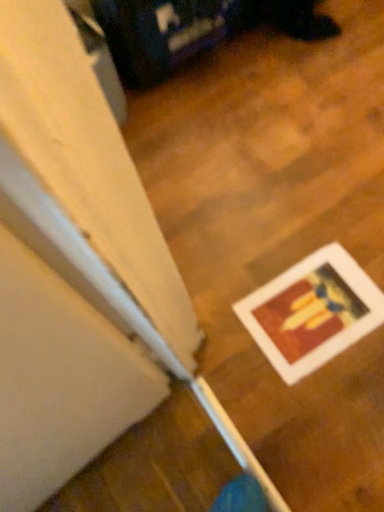
The width and height of the screenshot is (384, 512). What do you see at coordinates (312, 312) in the screenshot?
I see `white matte picture frame at lower right` at bounding box center [312, 312].

What are the coordinates of `white matte picture frame at lower right` in the screenshot? It's located at (312, 312).

The image size is (384, 512). What do you see at coordinates (279, 233) in the screenshot?
I see `wooden floor at lower right` at bounding box center [279, 233].

Where is `wooden floor at lower right`? This screenshot has width=384, height=512. wooden floor at lower right is located at coordinates (x=279, y=233).

Locate an element on the screen. The height and width of the screenshot is (512, 384). white matte picture frame at lower right is located at coordinates tap(312, 312).

Which is more to the left, white matte picture frame at lower right or wooden floor at lower right?

Positioned to the left is wooden floor at lower right.

Considering their positions, is white matte picture frame at lower right located in front of or behind wooden floor at lower right?

Clearly, white matte picture frame at lower right is behind wooden floor at lower right.

Is point (260, 340) positioned behind point (357, 112)?

That is False.

From the image's perspective, is white matte picture frame at lower right located beneath wooden floor at lower right?

Yes, from the image's perspective, white matte picture frame at lower right is beneath wooden floor at lower right.

Looking at this image, from a real-world perspective, who is located higher, white matte picture frame at lower right or wooden floor at lower right?

From a 3D spatial view, white matte picture frame at lower right is above.

Considering the relative sizes of white matte picture frame at lower right and wooden floor at lower right in the image provided, is white matte picture frame at lower right wider than wooden floor at lower right?

In fact, white matte picture frame at lower right might be narrower than wooden floor at lower right.

In terms of height, does white matte picture frame at lower right look taller or shorter compared to wooden floor at lower right?

Considering their sizes, white matte picture frame at lower right has more height than wooden floor at lower right.

Between white matte picture frame at lower right and wooden floor at lower right, which one has larger size?

With larger size is wooden floor at lower right.

Would you say white matte picture frame at lower right is inside or outside wooden floor at lower right?

white matte picture frame at lower right is contained in wooden floor at lower right.

Is white matte picture frame at lower right directly adjacent to wooden floor at lower right?

No, white matte picture frame at lower right is not making contact with wooden floor at lower right.

Is white matte picture frame at lower right oriented away from wooden floor at lower right?

Yes, white matte picture frame at lower right is facing away from wooden floor at lower right.

How far apart are white matte picture frame at lower right and wooden floor at lower right?

7.46 inches.

You are a GUI agent. You are given a task and a screenshot of the screen. Output one action in this format:
    pyautogui.click(x=<x>, y=<y>)
    Task: Click on the picture frame above the wooden floor at lower right (from a real-world perspective)
    
    Given the screenshot: What is the action you would take?
    pyautogui.click(x=312, y=312)

Can you confirm if wooden floor at lower right is positioned to the left of white matte picture frame at lower right?

Yes, wooden floor at lower right is to the left of white matte picture frame at lower right.

Which object is closer to the camera taking this photo, wooden floor at lower right or white matte picture frame at lower right?

wooden floor at lower right is closer to the camera.

Which point is more distant from viewer, (x=345, y=383) or (x=338, y=350)?

The point (x=338, y=350) is farther.

From the image's perspective, is wooden floor at lower right located beneath white matte picture frame at lower right?

No, from the image's perspective, wooden floor at lower right is not below white matte picture frame at lower right.

From a real-world perspective, between wooden floor at lower right and white matte picture frame at lower right, who is vertically lower?

wooden floor at lower right.

Considering the relative sizes of wooden floor at lower right and white matte picture frame at lower right in the image provided, is wooden floor at lower right wider than white matte picture frame at lower right?

Correct, the width of wooden floor at lower right exceeds that of white matte picture frame at lower right.

Which of these two, wooden floor at lower right or white matte picture frame at lower right, stands taller?

With more height is white matte picture frame at lower right.

Which of these two, wooden floor at lower right or white matte picture frame at lower right, is smaller?

With smaller size is white matte picture frame at lower right.

Would you say wooden floor at lower right is inside or outside white matte picture frame at lower right?

wooden floor at lower right is not enclosed by white matte picture frame at lower right.

In the scene shown: Is wooden floor at lower right not near white matte picture frame at lower right?

No, wooden floor at lower right is not far away from white matte picture frame at lower right.

From the picture: Is wooden floor at lower right facing towards white matte picture frame at lower right?

No, wooden floor at lower right is not facing towards white matte picture frame at lower right.

The width and height of the screenshot is (384, 512). In order to click on picture frame located above the wooden floor at lower right (from a real-world perspective) in this screenshot , I will do point(312,312).

I want to click on wood above the white matte picture frame at lower right (from the image's perspective), so click(x=279, y=233).

Where is `wood in front of the white matte picture frame at lower right`? The image size is (384, 512). wood in front of the white matte picture frame at lower right is located at coordinates (279, 233).